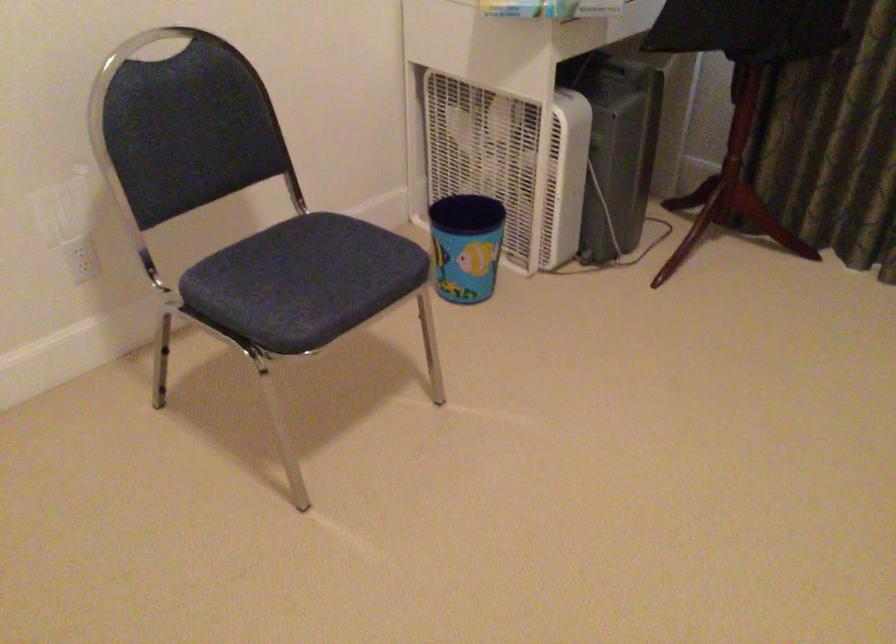
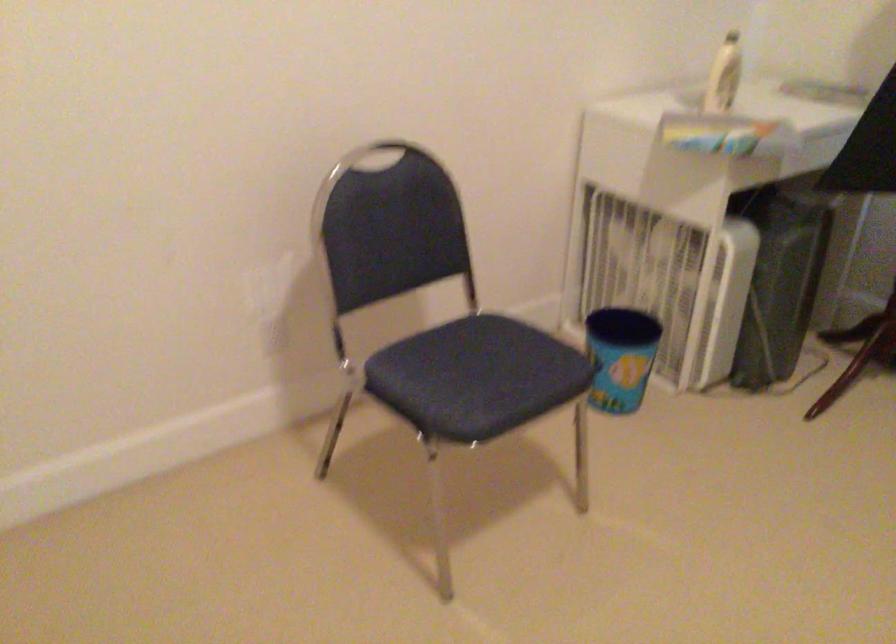
In the second image, find the point that corresponds to point (307, 276) in the first image.

(476, 377)